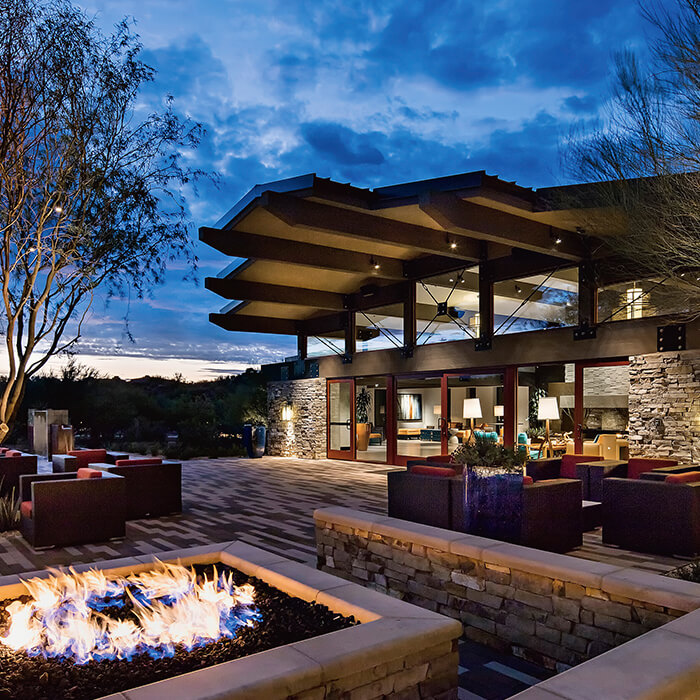
At what (x,y) coordinates should I click in order to perform the action: click on door. Please return your answer as a coordinate pair (x, y). The width and height of the screenshot is (700, 700). Looking at the image, I should click on (337, 424).